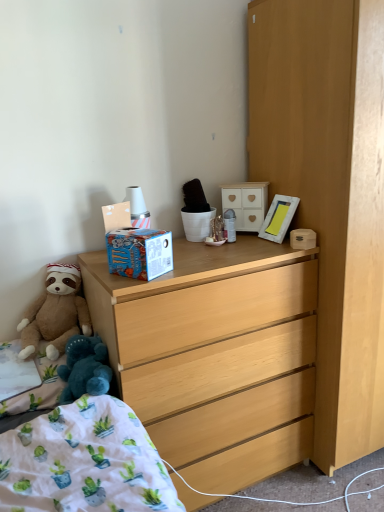
Question: Is brown plush teddy bear at lower left in front of or behind white wooden picture frame at upper right in the image?

Choices:
 (A) behind
 (B) front

Answer: (B)

Question: In terms of size, does brown plush teddy bear at lower left appear bigger or smaller than white wooden picture frame at upper right?

Choices:
 (A) small
 (B) big

Answer: (B)

Question: Which of these objects is positioned farthest from the light wood dresser at center?

Choices:
 (A) white wooden picture frame at upper right
 (B) brown plush teddy bear at lower left
 (C) white painted wood cabinet at upper center, the first cabinetry from the left
 (D) light wood dresser at right, which ranks as the 2th cabinetry in left-to-right order

Answer: (C)

Question: Which is farther from the light wood dresser at center?

Choices:
 (A) light wood dresser at right, the second cabinetry in the back-to-front sequence
 (B) white wooden picture frame at upper right
 (C) white painted wood cabinet at upper center, positioned as the 2th cabinetry in front-to-back order
 (D) brown plush teddy bear at lower left

Answer: (C)